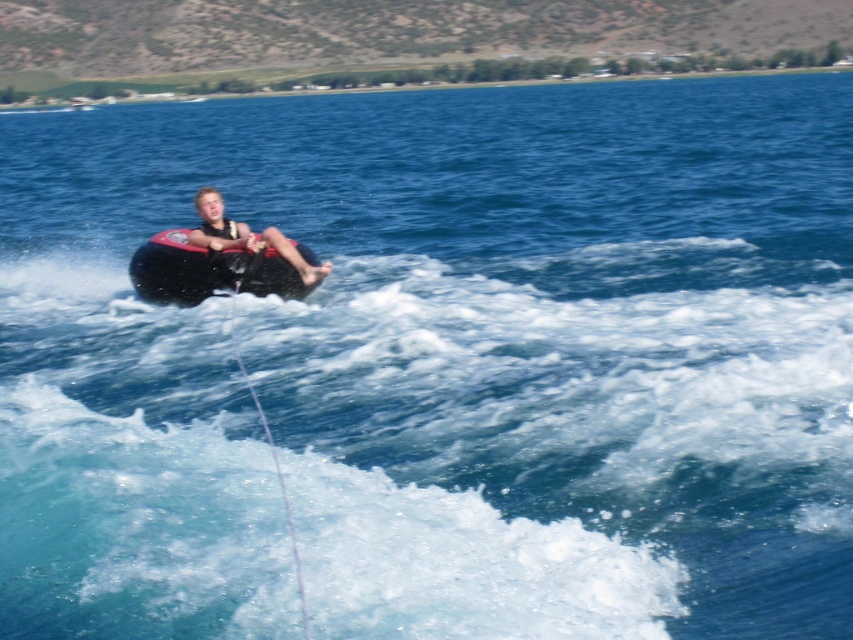
Question: Considering the real-world distances, which object is closest to the black rubber tube at center?

Choices:
 (A) matte black tube at center
 (B) white string at center

Answer: (A)

Question: Is matte black tube at center positioned behind white string at center?

Choices:
 (A) yes
 (B) no

Answer: (A)

Question: Which object is positioned closest to the white string at center?

Choices:
 (A) black rubber tube at center
 (B) matte black tube at center

Answer: (A)

Question: Which point appears farthest from the camera in this image?

Choices:
 (A) (195, 266)
 (B) (212, 241)

Answer: (B)

Question: Is matte black tube at center wider than white string at center?

Choices:
 (A) no
 (B) yes

Answer: (B)

Question: Is black rubber tube at center closer to the viewer compared to matte black tube at center?

Choices:
 (A) yes
 (B) no

Answer: (B)